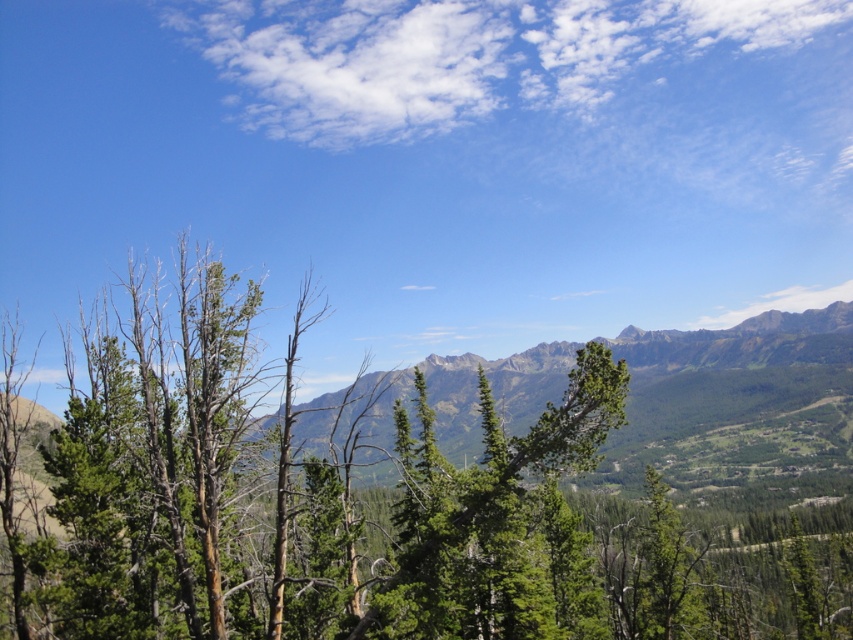
You are an artist planning to paint the scene. You want to ensure the green textured tree at center and the green textured mountain range at center are proportionally accurate. Which object should you make wider in your painting?

The green textured tree at center should be made wider in the painting since its width surpasses that of the green textured mountain range at center according to the description.

You are a hiker standing at the camera position and want to reach the green textured tree at center. If your maximum comfortable walking distance is 100 feet, can you comfortably walk to it?

The green textured tree at center is 101.90 feet away from the camera, which exceeds your maximum comfortable walking distance of 100 feet. Therefore, you cannot comfortably walk to it.